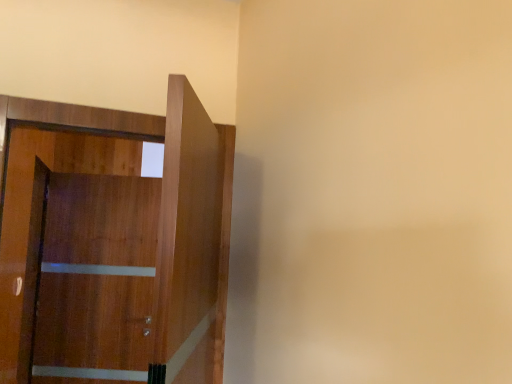
Question: Is wooden door at left located outside wooden barn door at left?

Choices:
 (A) yes
 (B) no

Answer: (A)

Question: Does wooden door at left have a larger size compared to wooden barn door at left?

Choices:
 (A) yes
 (B) no

Answer: (B)

Question: From a real-world perspective, is wooden door at left physically below wooden barn door at left?

Choices:
 (A) no
 (B) yes

Answer: (A)

Question: Can you confirm if wooden door at left is shorter than wooden barn door at left?

Choices:
 (A) no
 (B) yes

Answer: (B)

Question: From a real-world perspective, is wooden door at left physically above wooden barn door at left?

Choices:
 (A) no
 (B) yes

Answer: (B)

Question: Is there a large distance between wooden door at left and wooden barn door at left?

Choices:
 (A) no
 (B) yes

Answer: (A)

Question: Is wooden barn door at left shorter than wooden door at left?

Choices:
 (A) yes
 (B) no

Answer: (B)

Question: From a real-world perspective, is wooden barn door at left located beneath wooden door at left?

Choices:
 (A) yes
 (B) no

Answer: (A)

Question: Can you confirm if wooden barn door at left is bigger than wooden door at left?

Choices:
 (A) yes
 (B) no

Answer: (A)

Question: Does wooden barn door at left have a greater height compared to wooden door at left?

Choices:
 (A) no
 (B) yes

Answer: (B)

Question: Does wooden barn door at left lie behind wooden door at left?

Choices:
 (A) no
 (B) yes

Answer: (B)

Question: Is wooden barn door at left wider than wooden door at left?

Choices:
 (A) no
 (B) yes

Answer: (A)

Question: From the image's perspective, is wooden barn door at left located above or below wooden door at left?

Choices:
 (A) below
 (B) above

Answer: (A)